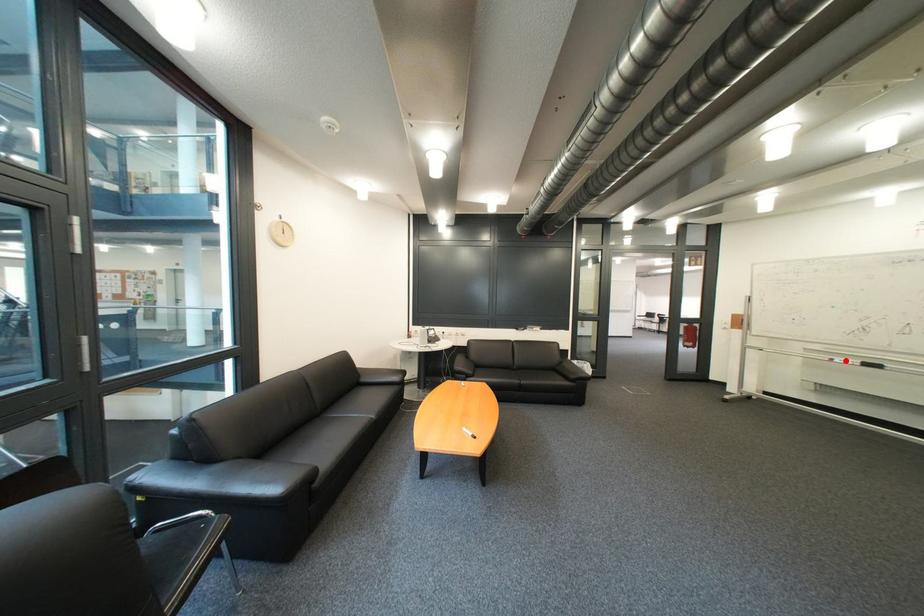
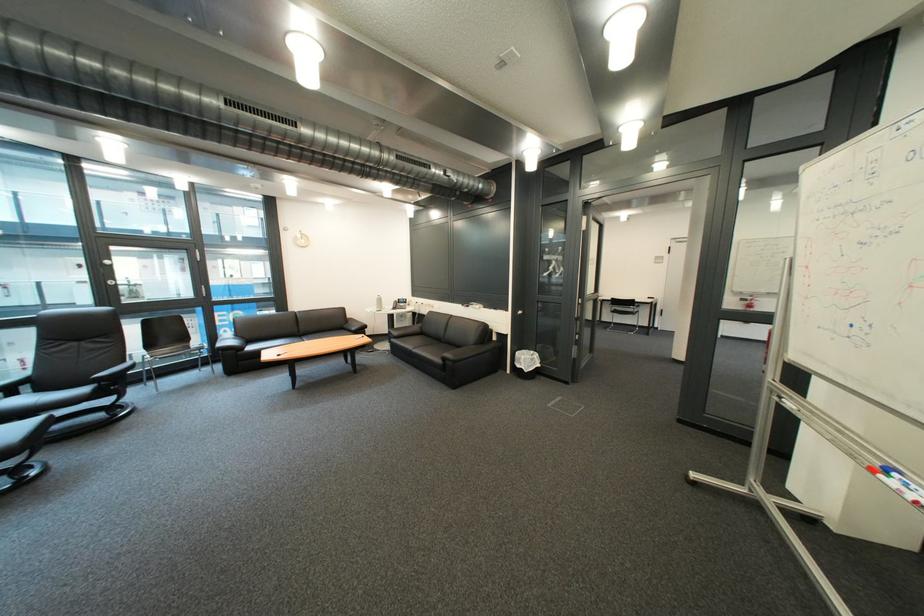
Question: I am providing you with two images of the same scene from different viewpoints. Given a red point in image1, look at the same physical point in image2. Is it:

Choices:
 (A) Closer to the viewpoint
 (B) Farther from the viewpoint

Answer: (B)